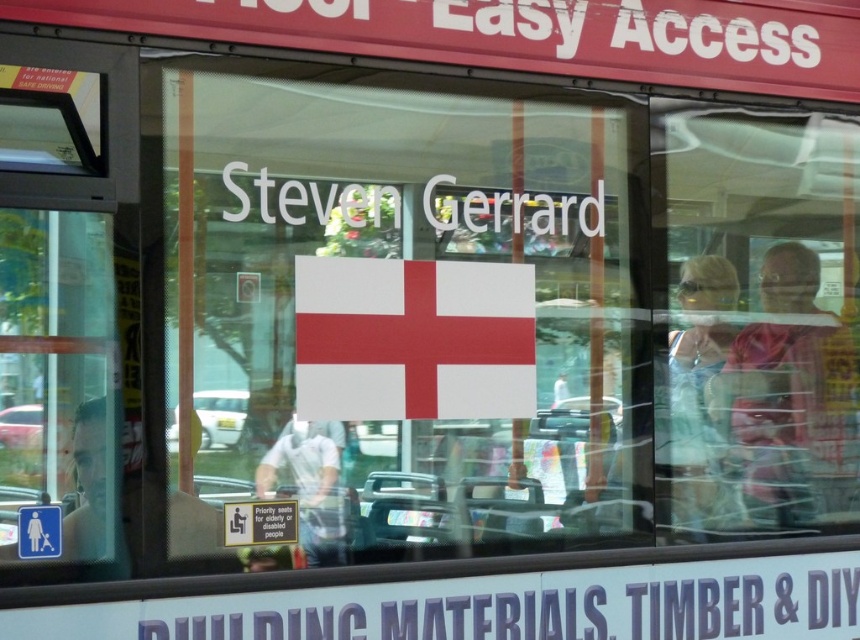
You are a passenger on the bus and want to read the text on the white paper at center and the white matte flag at center. Which object is wider so that you can read its text more easily?

The white paper at center is wider than the white matte flag at center, so you can read its text more easily.

You are a bus passenger trying to read the white paper at center and the white matte flag at center through the bus window. Since both are at the center, can you tell me which one is closer to you?

The distance between the white paper at center and the white matte flag at center is 4.15 inches, but since both are at the center, it is unclear which one is closer without additional spatial cues.